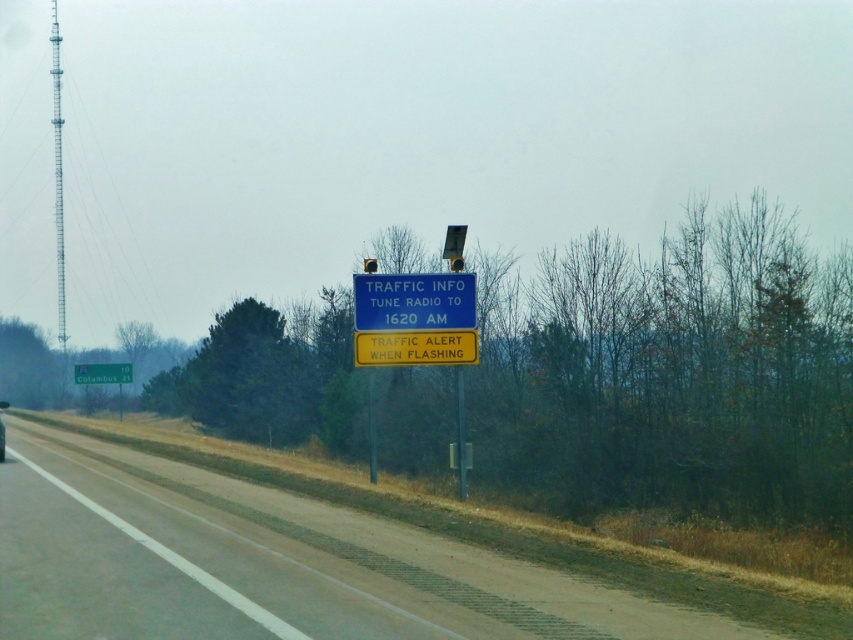
You are a driver approaching the roadside scene described. You need to locate the blue plastic traffic sign at center. According to the scene description, where exactly is it positioned?

The blue plastic traffic sign at center is located at point 0.485 on the coordinate system provided.

You are driving on a rural road and see the blue plastic traffic sign at center and the yellow plastic traffic sign at center ahead. Which sign is taller?

The blue plastic traffic sign at center is taller than the yellow plastic traffic sign at center.

You are a driver approaching the traffic information sign mounted on the metal pole. You need to locate the point at coordinates point (413,301). Which object is this point located on?

The point (413,301) is located on the blue plastic traffic sign at center.